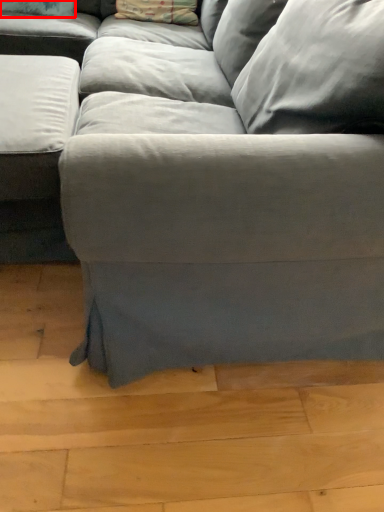
Question: Considering the relative positions of pillow (annotated by the red box) and pillow in the image provided, where is pillow (annotated by the red box) located with respect to the staircase?

Choices:
 (A) right
 (B) left

Answer: (B)